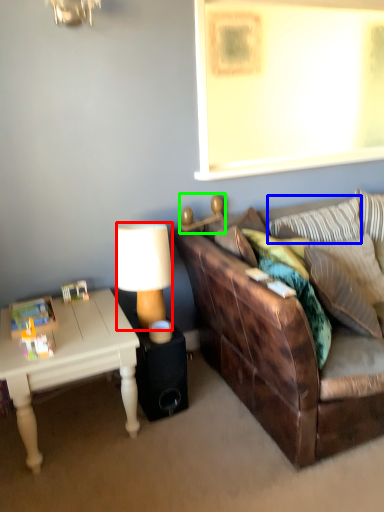
Question: Based on their relative distances, which object is nearer to lamp (highlighted by a red box)? Choose from pillow (highlighted by a blue box) and lamp (highlighted by a green box).

Choices:
 (A) pillow
 (B) lamp

Answer: (B)